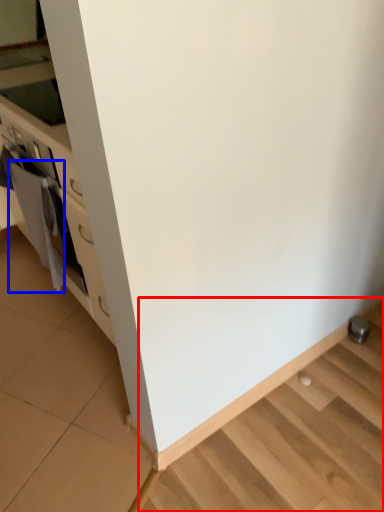
Question: Which object appears closest to the camera in this image, stairwell (highlighted by a red box) or material (highlighted by a blue box)?

Choices:
 (A) stairwell
 (B) material

Answer: (A)